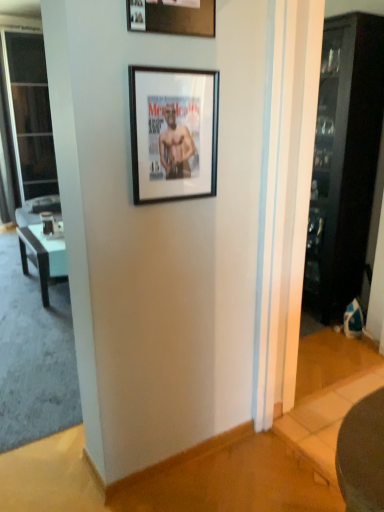
Question: Which direction should I rotate to look at black matte picture frame at upper center, which is the 2th picture frame from top to bottom?

Choices:
 (A) left
 (B) right

Answer: (A)

Question: From the image's perspective, is wooden picture frame at upper center, positioned as the 2th picture frame in bottom-to-top order, above black matte picture frame at upper center, which is the 2th picture frame from top to bottom?

Choices:
 (A) no
 (B) yes

Answer: (B)

Question: Is wooden picture frame at upper center, which ranks as the 1th picture frame in top-to-bottom order, aimed at black matte picture frame at upper center, marked as the first picture frame in a bottom-to-top arrangement?

Choices:
 (A) no
 (B) yes

Answer: (A)

Question: Is wooden picture frame at upper center, positioned as the 2th picture frame in bottom-to-top order, further to the viewer compared to black matte picture frame at upper center, marked as the first picture frame in a bottom-to-top arrangement?

Choices:
 (A) yes
 (B) no

Answer: (B)

Question: Can you see wooden picture frame at upper center, positioned as the 2th picture frame in bottom-to-top order, touching black matte picture frame at upper center, which is the 2th picture frame from top to bottom?

Choices:
 (A) no
 (B) yes

Answer: (A)

Question: Is wooden picture frame at upper center, positioned as the 2th picture frame in bottom-to-top order, positioned beyond the bounds of black matte picture frame at upper center, marked as the first picture frame in a bottom-to-top arrangement?

Choices:
 (A) no
 (B) yes

Answer: (B)

Question: Does wooden picture frame at upper center, positioned as the 2th picture frame in bottom-to-top order, appear on the left side of black matte picture frame at upper center, marked as the first picture frame in a bottom-to-top arrangement?

Choices:
 (A) yes
 (B) no

Answer: (A)

Question: Considering the relative sizes of dark wood cabinet at right and black glossy table at left in the image provided, is dark wood cabinet at right smaller than black glossy table at left?

Choices:
 (A) yes
 (B) no

Answer: (B)

Question: Is the surface of dark wood cabinet at right in direct contact with black glossy table at left?

Choices:
 (A) no
 (B) yes

Answer: (A)

Question: From a real-world perspective, does dark wood cabinet at right stand above black glossy table at left?

Choices:
 (A) no
 (B) yes

Answer: (B)

Question: Considering the relative sizes of dark wood cabinet at right and black glossy table at left in the image provided, is dark wood cabinet at right shorter than black glossy table at left?

Choices:
 (A) no
 (B) yes

Answer: (A)

Question: Does dark wood cabinet at right appear on the left side of black glossy table at left?

Choices:
 (A) no
 (B) yes

Answer: (A)

Question: Is dark wood cabinet at right further to camera compared to black glossy table at left?

Choices:
 (A) no
 (B) yes

Answer: (A)

Question: From a real-world perspective, is wooden picture frame at upper center, positioned as the 2th picture frame in bottom-to-top order, beneath black glossy table at left?

Choices:
 (A) yes
 (B) no

Answer: (B)